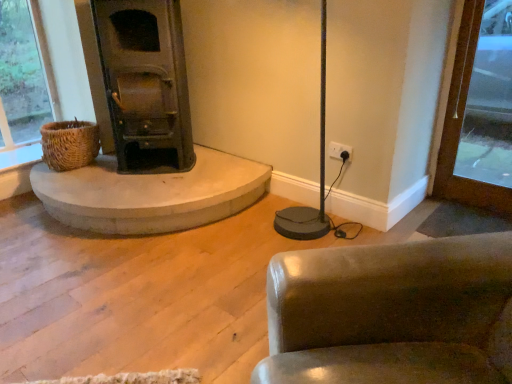
Where is `vacant space that is to the left of brown wood door at right`? Image resolution: width=512 pixels, height=384 pixels. vacant space that is to the left of brown wood door at right is located at coordinates (439, 208).